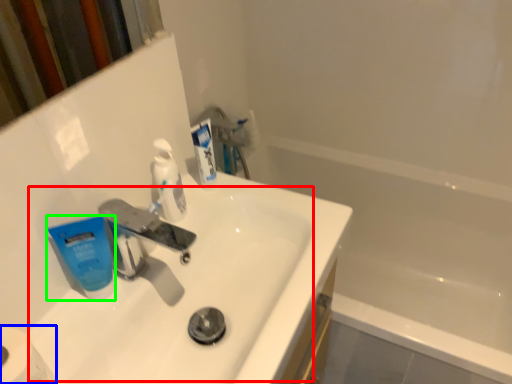
Question: Estimate the real-world distances between objects in this image. Which object is closer to sink (highlighted by a red box), toilet paper (highlighted by a blue box) or toothpaste (highlighted by a green box)?

Choices:
 (A) toilet paper
 (B) toothpaste

Answer: (B)